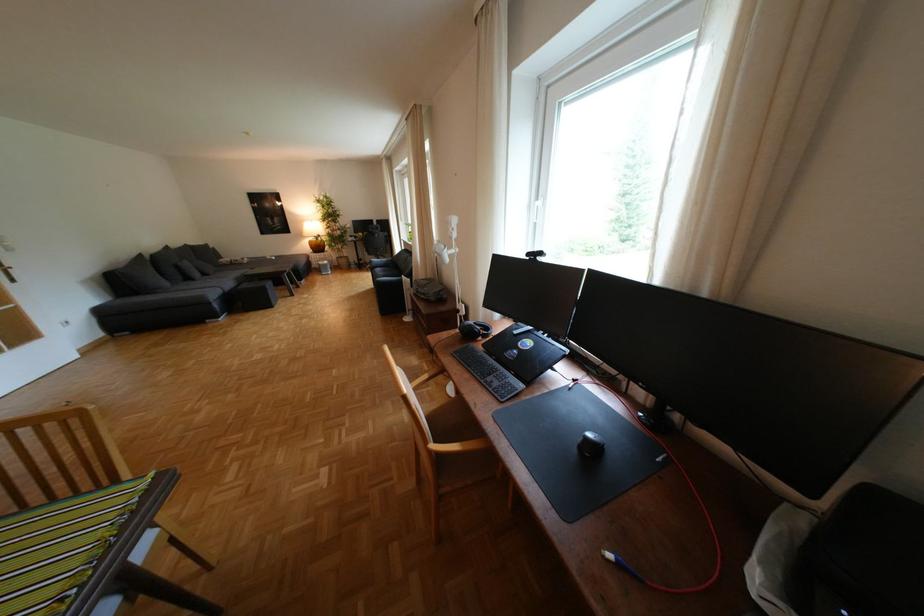
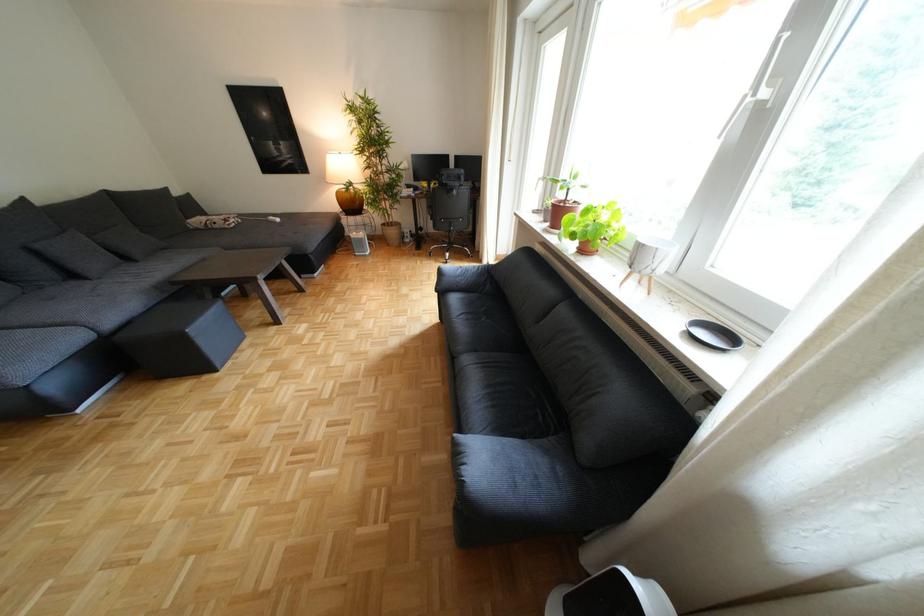
Where in the second image is the point corresponding to [190,267] from the first image?

(49, 253)